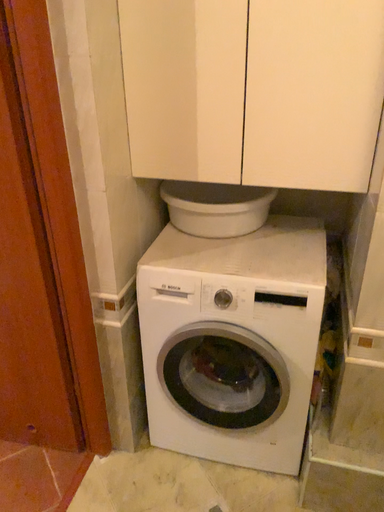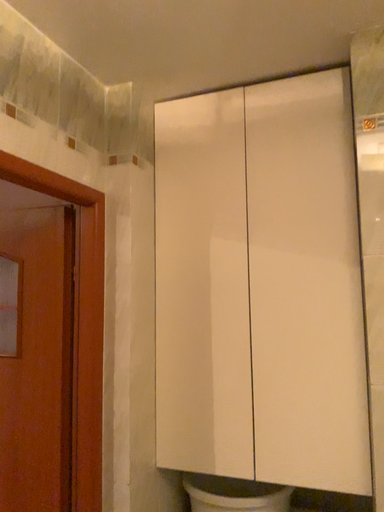
Question: Which way did the camera rotate in the video?

Choices:
 (A) rotated downward
 (B) rotated upward

Answer: (B)